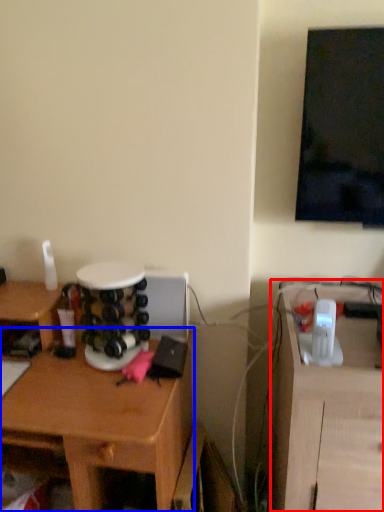
Question: Which of the following is the closest to the observer, computer desk (highlighted by a red box) or desk (highlighted by a blue box)?

Choices:
 (A) computer desk
 (B) desk

Answer: (A)